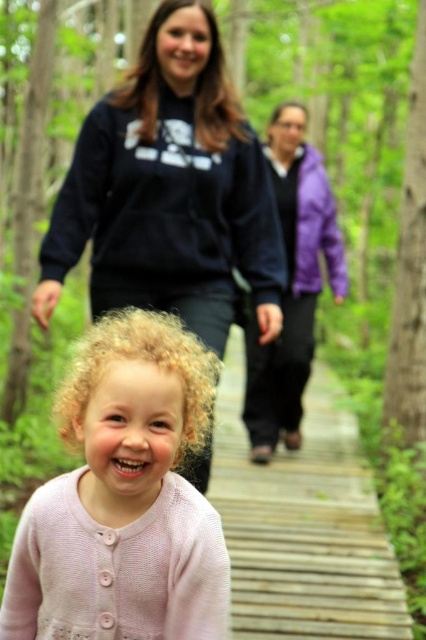
Based on the photo, you are a photographer trying to capture the child in the pink knitted sweater at center. Based on their position, which direction should you move to get them in the frame?

The pink knitted sweater at center is located at point 0.778 on the x and 0.293 on the y. To center the child in your frame, move slightly to the right and down to align with these coordinates.

You are a photographer trying to capture a photo of the pink knitted sweater at center and the dark blue fleece sweatshirt at upper center. Which one is closer to the camera?

→ The pink knitted sweater at center is positioned under the dark blue fleece sweatshirt at upper center, so the pink knitted sweater at center is closer to the camera.

From the picture: You are a photographer trying to capture the child in the pink knitted sweater at center and the adult in the purple fleece jacket at center. Based on their positions, which one is closer to the camera?

The pink knitted sweater at center is positioned under the purple fleece jacket at center, so the purple fleece jacket at center is closer to the camera.